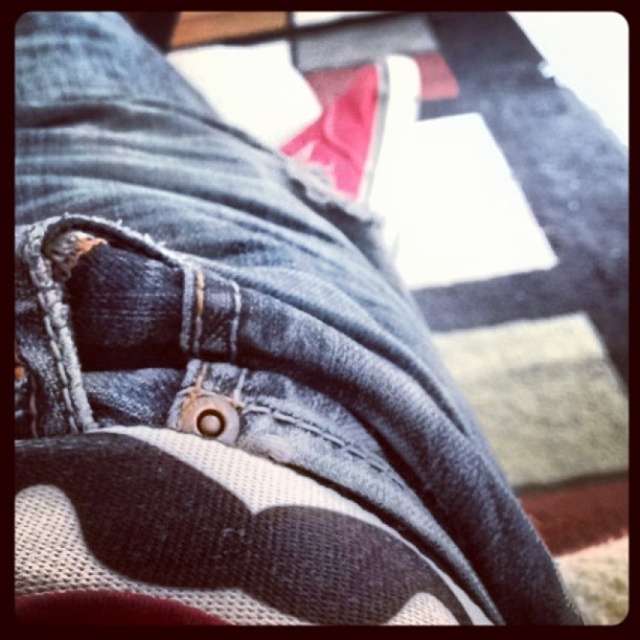
Question: Among these points, which one is farthest from the camera?

Choices:
 (A) (340, 186)
 (B) (218, 472)

Answer: (A)

Question: Which of the following is the farthest from the observer?

Choices:
 (A) matte pink fabric shoe at center
 (B) black canvas shoe at lower center

Answer: (A)

Question: Can you confirm if black canvas shoe at lower center is positioned above matte pink fabric shoe at center?

Choices:
 (A) yes
 (B) no

Answer: (B)

Question: Can you confirm if black canvas shoe at lower center is positioned below matte pink fabric shoe at center?

Choices:
 (A) no
 (B) yes

Answer: (B)

Question: Which point appears farthest from the camera in this image?

Choices:
 (A) (330, 172)
 (B) (358, 572)

Answer: (A)

Question: Is black canvas shoe at lower center wider than matte pink fabric shoe at center?

Choices:
 (A) yes
 (B) no

Answer: (B)